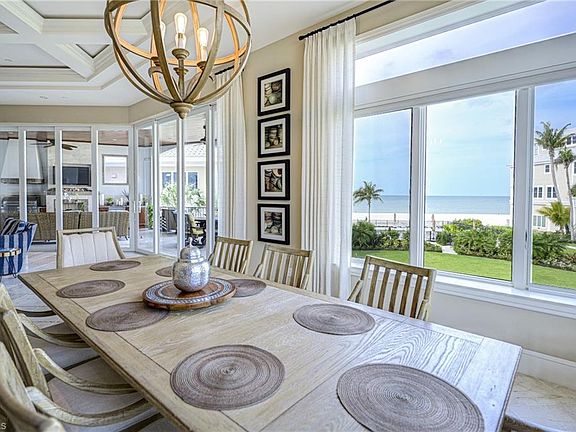
Identify the location of candles. This screenshot has width=576, height=432. (172, 49).